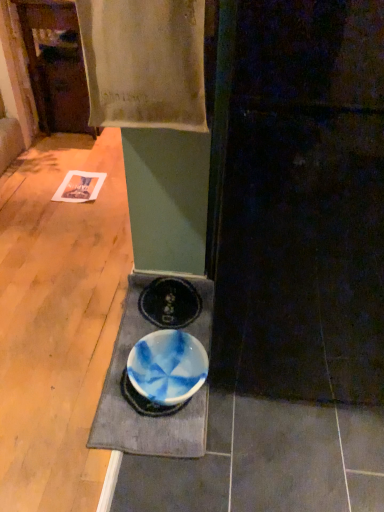
Question: Does blue glazed bowl at lower center have a smaller size compared to white cotton towel at upper center?

Choices:
 (A) no
 (B) yes

Answer: (B)

Question: Is blue glazed bowl at lower center thinner than white cotton towel at upper center?

Choices:
 (A) yes
 (B) no

Answer: (B)

Question: Is blue glazed bowl at lower center outside white cotton towel at upper center?

Choices:
 (A) no
 (B) yes

Answer: (B)

Question: Does blue glazed bowl at lower center appear on the left side of white cotton towel at upper center?

Choices:
 (A) no
 (B) yes

Answer: (A)

Question: Is blue glazed bowl at lower center oriented away from white cotton towel at upper center?

Choices:
 (A) no
 (B) yes

Answer: (A)

Question: Considering the positions of point (274, 67) and point (144, 395), is point (274, 67) closer or farther from the camera than point (144, 395)?

Choices:
 (A) farther
 (B) closer

Answer: (B)

Question: Considering the positions of smooth dark wood door at center and blue glazed bowl at lower center in the image, is smooth dark wood door at center taller or shorter than blue glazed bowl at lower center?

Choices:
 (A) short
 (B) tall

Answer: (B)

Question: From the image's perspective, is smooth dark wood door at center positioned above or below blue glazed bowl at lower center?

Choices:
 (A) below
 (B) above

Answer: (B)

Question: Looking at the image, does smooth dark wood door at center seem bigger or smaller compared to blue glazed bowl at lower center?

Choices:
 (A) small
 (B) big

Answer: (B)

Question: Is blue glossy bowl at center in front of or behind blue glazed bowl at lower center in the image?

Choices:
 (A) front
 (B) behind

Answer: (A)

Question: Considering the positions of point (163, 426) and point (157, 397), is point (163, 426) closer or farther from the camera than point (157, 397)?

Choices:
 (A) farther
 (B) closer

Answer: (B)

Question: From a real-world perspective, is blue glossy bowl at center physically located above or below blue glazed bowl at lower center?

Choices:
 (A) below
 (B) above

Answer: (A)

Question: Do you think blue glossy bowl at center is within blue glazed bowl at lower center, or outside of it?

Choices:
 (A) inside
 (B) outside

Answer: (B)

Question: Would you say white cotton towel at upper center is inside or outside smooth dark wood door at center?

Choices:
 (A) outside
 (B) inside

Answer: (A)

Question: From a real-world perspective, is white cotton towel at upper center above or below smooth dark wood door at center?

Choices:
 (A) below
 (B) above

Answer: (B)